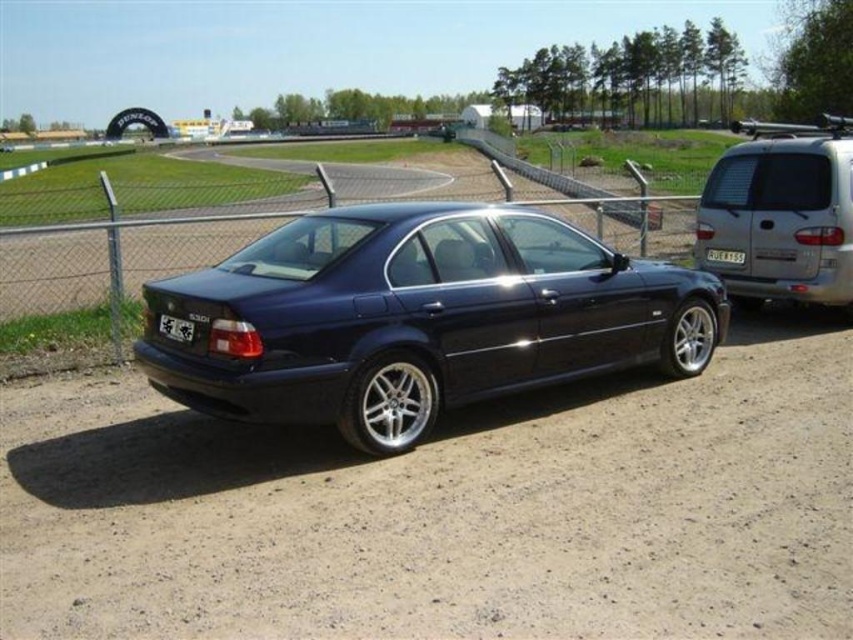
Based on the photo, you are a photographer setting up a camera at the same level as the glossy dark blue sedan at center and the satin silver van at right. Which vehicle will have its roof appear higher in your camera frame?

The glossy dark blue sedan at center is much taller than the satin silver van at right, so its roof will appear higher in the camera frame.